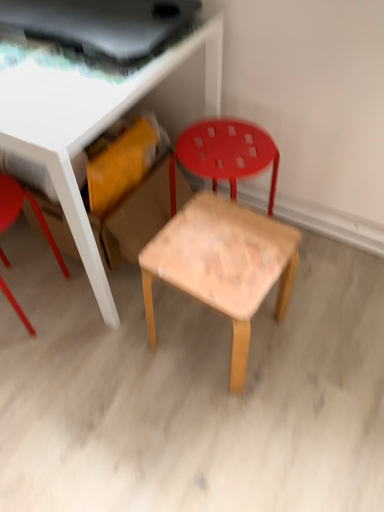
Identify the location of free location in front of natural wood stool at center. This screenshot has width=384, height=512. point(211,432).